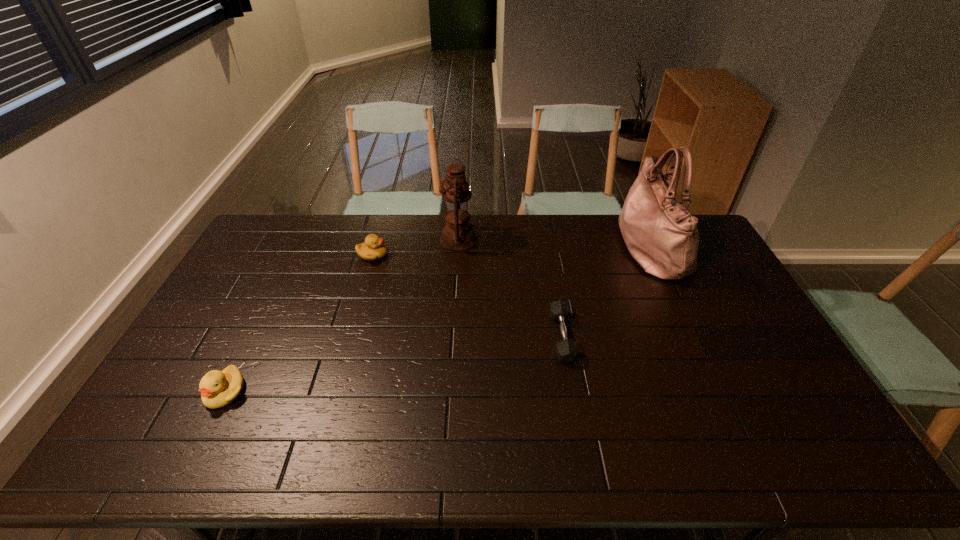
Image resolution: width=960 pixels, height=540 pixels. Find the location of `object located in the left edge section of the desktop`. object located in the left edge section of the desktop is located at coordinates (218, 389).

I want to click on object that is at the right edge, so click(661, 234).

The image size is (960, 540). I want to click on object that is at the far right corner, so click(x=661, y=234).

You are a GUI agent. You are given a task and a screenshot of the screen. Output one action in this format:
    pyautogui.click(x=<x>, y=<y>)
    Task: Click on the vacant space at the far edge of the desktop
    The image size is (960, 540).
    Given the screenshot: What is the action you would take?
    pyautogui.click(x=492, y=229)

The height and width of the screenshot is (540, 960). In order to click on free space at the near edge in this screenshot , I will do `click(610, 442)`.

You are a GUI agent. You are given a task and a screenshot of the screen. Output one action in this format:
    pyautogui.click(x=<x>, y=<y>)
    Task: Click on the vacant space at the left edge of the desktop
    Image resolution: width=960 pixels, height=540 pixels.
    Given the screenshot: What is the action you would take?
    pyautogui.click(x=210, y=356)

Identify the location of vacant space at the right edge of the desktop. The width and height of the screenshot is (960, 540). (710, 259).

Locate an element on the screen. The height and width of the screenshot is (540, 960). free space at the near right corner of the desktop is located at coordinates (816, 451).

Locate an element on the screen. The image size is (960, 540). empty location between the oil lamp and the farther duckling is located at coordinates (416, 247).

The image size is (960, 540). What are the coordinates of `blank region between the dumbbell and the left duckling` in the screenshot? It's located at (394, 364).